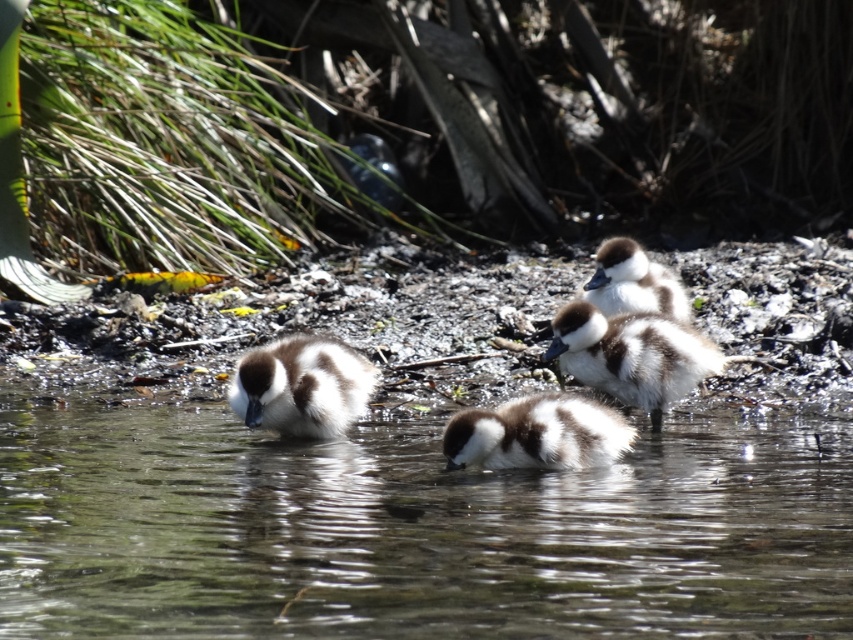
Question: Based on their relative distances, which object is nearer to the brown fluffy duckling at center?

Choices:
 (A) brown and white fluffy duckling at center
 (B) brown speckled duckling at center
 (C) translucent water at center

Answer: (A)

Question: Which object appears farthest from the camera in this image?

Choices:
 (A) brown and white fluffy duckling at center
 (B) brown fluffy duckling at upper right

Answer: (B)

Question: Is brown and white fluffy duckling at center above brown fluffy duckling at upper right?

Choices:
 (A) no
 (B) yes

Answer: (A)

Question: Does brown speckled duckling at center come in front of brown fluffy duckling at upper right?

Choices:
 (A) yes
 (B) no

Answer: (A)

Question: Where is translucent water at center located in relation to brown speckled duckling at center in the image?

Choices:
 (A) left
 (B) right

Answer: (B)

Question: Among these points, which one is nearest to the camera?

Choices:
 (A) (276, 426)
 (B) (677, 380)
 (C) (483, 410)

Answer: (C)